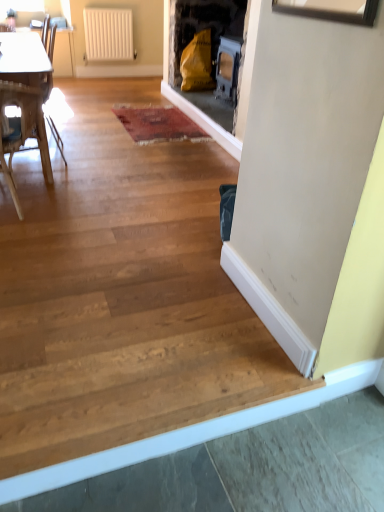
What do you see at coordinates (55, 135) in the screenshot?
I see `wooden armchair at left` at bounding box center [55, 135].

Measure the distance between point (91, 54) and camera.

Point (91, 54) and camera are 6.56 meters apart from each other.

What do you see at coordinates (108, 34) in the screenshot? I see `white plastic radiator at upper center` at bounding box center [108, 34].

At what (x,y) coordinates should I click in order to perform the action: click on wooden chair at left. Please return your answer as a coordinate pair (x, y). Image resolution: width=384 pixels, height=512 pixels. Looking at the image, I should click on (22, 131).

Considering the relative positions of white plastic radiator at upper center and wooden armchair at left in the image provided, is white plastic radiator at upper center in front of wooden armchair at left?

No, the depth of white plastic radiator at upper center is greater than that of wooden armchair at left.

Considering the positions of objects white plastic radiator at upper center and wooden armchair at left in the image provided, who is more to the left, white plastic radiator at upper center or wooden armchair at left?

Positioned to the left is wooden armchair at left.

You are a GUI agent. You are given a task and a screenshot of the screen. Output one action in this format:
    pyautogui.click(x=<x>, y=<y>)
    Task: Click on the radiator behind the wooden armchair at left
    This screenshot has height=512, width=384.
    Given the screenshot: What is the action you would take?
    pyautogui.click(x=108, y=34)

From the picture: In terms of width, does white plastic radiator at upper center look wider or thinner when compared to wooden armchair at left?

Clearly, white plastic radiator at upper center has less width compared to wooden armchair at left.

From the picture: Considering the relative positions of wooden armchair at left and white plastic radiator at upper center in the image provided, is wooden armchair at left to the left or to the right of white plastic radiator at upper center?

In the image, wooden armchair at left appears on the left side of white plastic radiator at upper center.

From the image's perspective, does wooden armchair at left appear higher than white plastic radiator at upper center?

No.

Considering the relative positions of wooden armchair at left and white plastic radiator at upper center in the image provided, is wooden armchair at left in front of white plastic radiator at upper center?

Yes, wooden armchair at left is in front of white plastic radiator at upper center.

I want to click on chair located below the white plastic radiator at upper center (from the image's perspective), so click(x=22, y=131).

From a real-world perspective, which is physically below, white plastic radiator at upper center or wooden chair at left?

wooden chair at left, from a real-world perspective.

Does white plastic radiator at upper center come in front of wooden chair at left?

No.

From the image's perspective, does white plastic radiator at upper center appear lower than wooden chair at left?

No.

Considering the sizes of objects wooden armchair at left and wooden chair at left in the image provided, who is bigger, wooden armchair at left or wooden chair at left?

Bigger between the two is wooden chair at left.

Locate an element on the screen. The width and height of the screenshot is (384, 512). chair in front of the wooden armchair at left is located at coordinates (22, 131).

Is point (62, 142) positioned behind point (16, 96)?

Yes.

From a real-world perspective, is wooden armchair at left under wooden chair at left?

Incorrect, from a real-world perspective, wooden armchair at left is higher than wooden chair at left.

Considering the positions of objects wooden chair at left and wooden armchair at left in the image provided, who is more to the right, wooden chair at left or wooden armchair at left?

From the viewer's perspective, wooden chair at left appears more on the right side.

At what (x,y) coordinates should I click in order to perform the action: click on chair beneath the wooden armchair at left (from a real-world perspective). Please return your answer as a coordinate pair (x, y). Looking at the image, I should click on (22, 131).

Is wooden chair at left bigger or smaller than wooden armchair at left?

Considering their sizes, wooden chair at left takes up more space than wooden armchair at left.

In terms of width, does wooden chair at left look wider or thinner when compared to wooden armchair at left?

Clearly, wooden chair at left has more width compared to wooden armchair at left.

From a real-world perspective, is wooden chair at left on top of white plastic radiator at upper center?

No, from a real-world perspective, wooden chair at left is not on top of white plastic radiator at upper center.

Locate an element on the screen. chair that is in front of the white plastic radiator at upper center is located at coordinates (22, 131).

Does point (20, 88) come in front of point (118, 53)?

Yes, point (20, 88) is in front of point (118, 53).

Where is `armchair that appears in front of the white plastic radiator at upper center`? The width and height of the screenshot is (384, 512). armchair that appears in front of the white plastic radiator at upper center is located at coordinates pyautogui.click(x=55, y=135).

Locate an element on the screen. This screenshot has width=384, height=512. armchair that appears below the white plastic radiator at upper center (from the image's perspective) is located at coordinates coord(55,135).

In the scene shown: Considering their positions, is wooden armchair at left positioned closer to wooden chair at left than white plastic radiator at upper center?

The object closer to wooden chair at left is wooden armchair at left.

Which object lies further to the anchor point white plastic radiator at upper center, wooden armchair at left or wooden chair at left?

wooden chair at left is further to white plastic radiator at upper center.

From the image, which object appears to be nearer to wooden armchair at left, white plastic radiator at upper center or wooden chair at left?

Based on the image, white plastic radiator at upper center appears to be nearer to wooden armchair at left.

Based on their spatial positions, is white plastic radiator at upper center or wooden armchair at left further from wooden chair at left?

white plastic radiator at upper center lies further to wooden chair at left than the other object.

Estimate the real-world distances between objects in this image. Which object is closer to wooden armchair at left, wooden chair at left or white plastic radiator at upper center?

The object closer to wooden armchair at left is white plastic radiator at upper center.

In the scene shown: Considering their positions, is wooden chair at left positioned further to white plastic radiator at upper center than wooden armchair at left?

Among the two, wooden chair at left is located further to white plastic radiator at upper center.

Image resolution: width=384 pixels, height=512 pixels. I want to click on armchair between wooden chair at left and white plastic radiator at upper center along the z-axis, so click(55, 135).